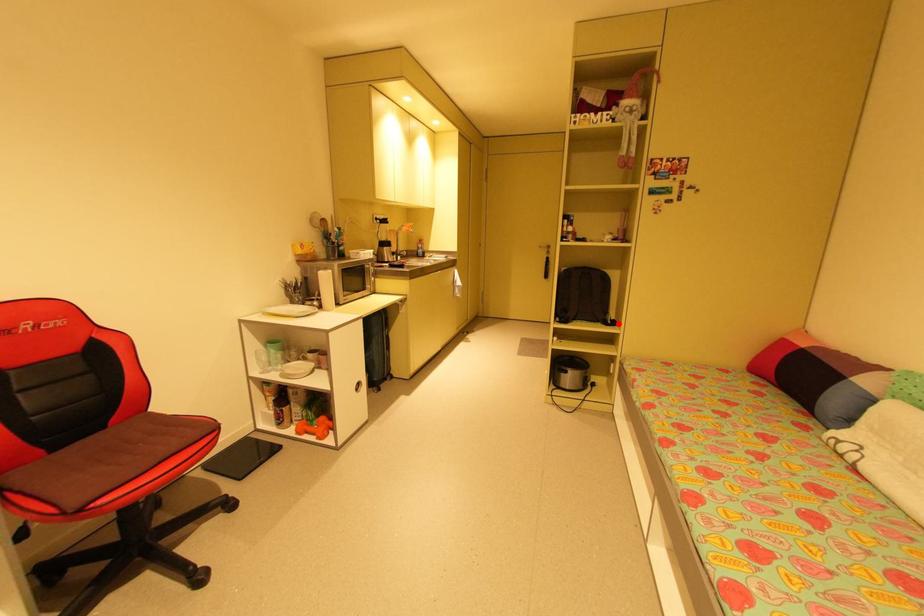
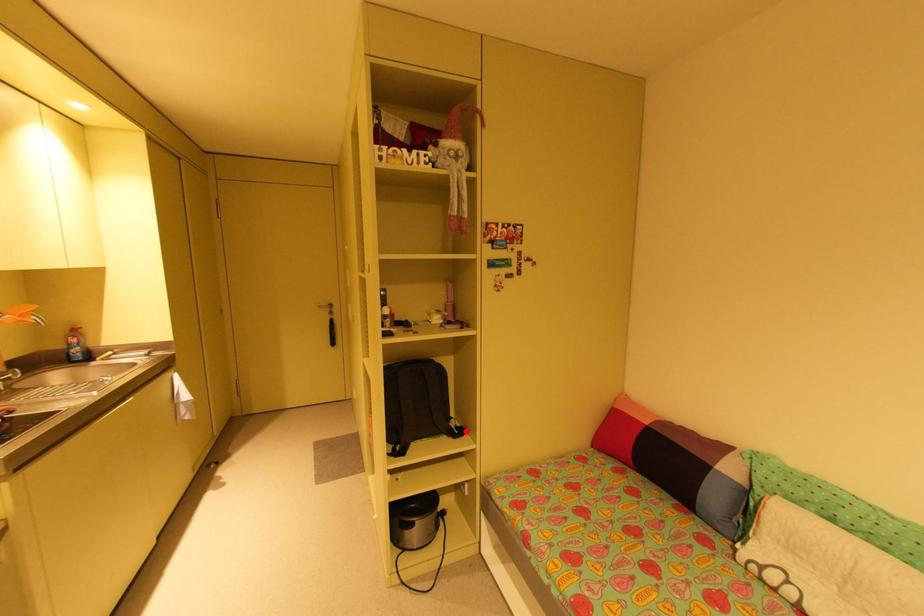
I am providing you with two images of the same scene from different viewpoints. A red point is marked on the first image and another point is marked on the second image. Are the points marked in image1 and image2 representing the same 3D position?

Yes